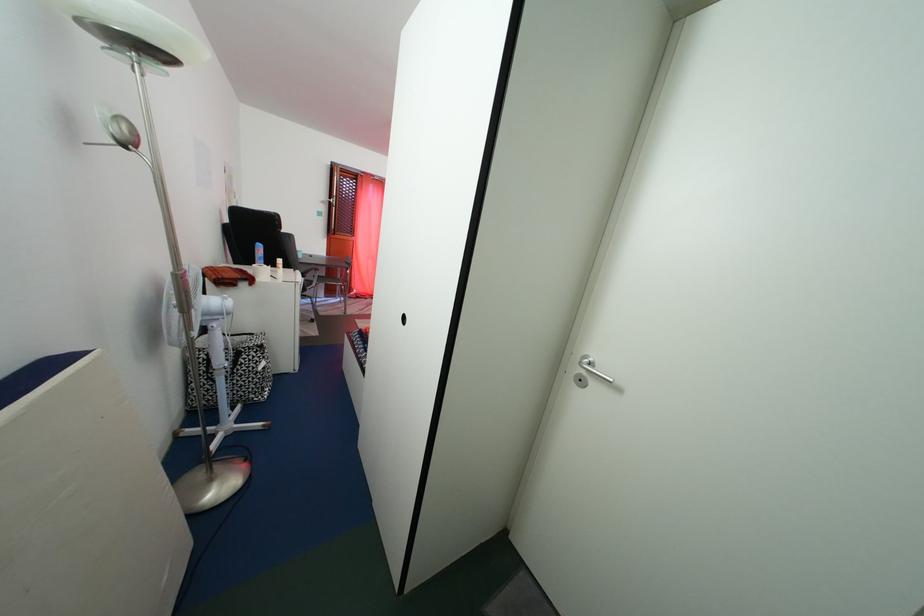
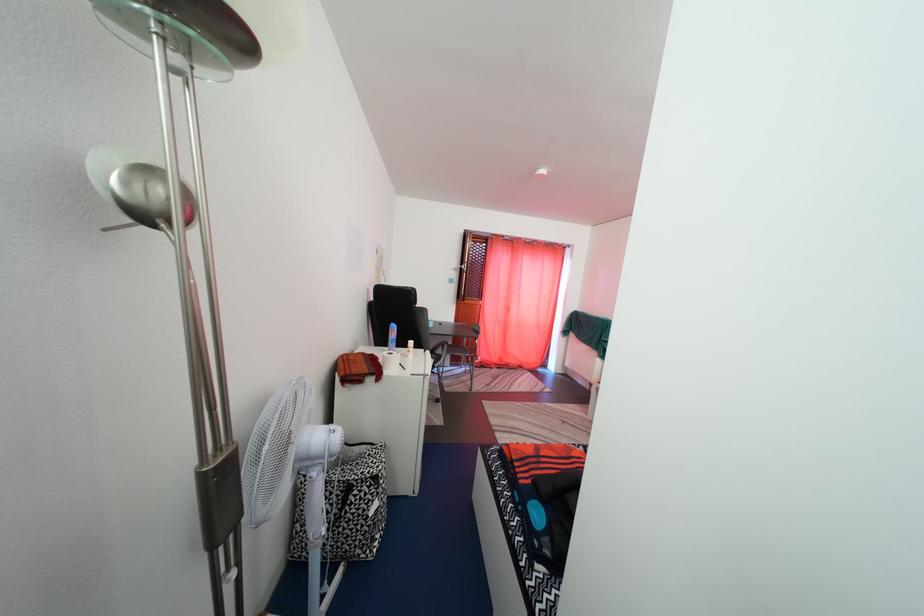
Question: The camera is either moving clockwise (left) or counter-clockwise (right) around the object. The first image is from the beginning of the video and the second image is from the end. Is the camera moving left or right when shooting the video?

Choices:
 (A) Left
 (B) Right

Answer: (B)